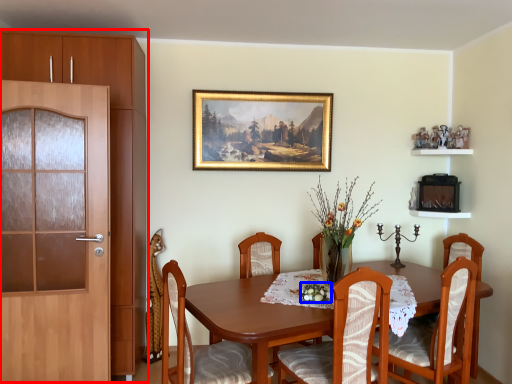
Question: Which object appears farthest to the camera in this image, cabinetry (highlighted by a red box) or floral arrangement (highlighted by a blue box)?

Choices:
 (A) cabinetry
 (B) floral arrangement

Answer: (A)